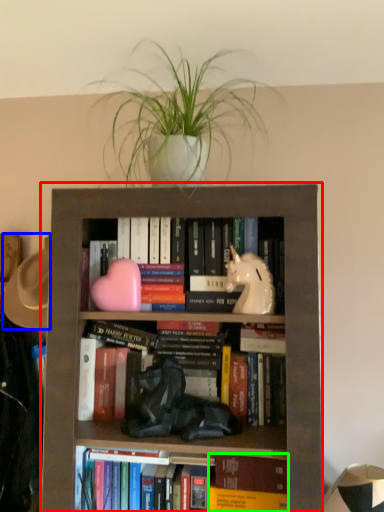
Question: Which object is positioned closest to bookcase (highlighted by a red box)? Select from hat (highlighted by a blue box) and paperback book (highlighted by a green box).

Choices:
 (A) hat
 (B) paperback book

Answer: (B)